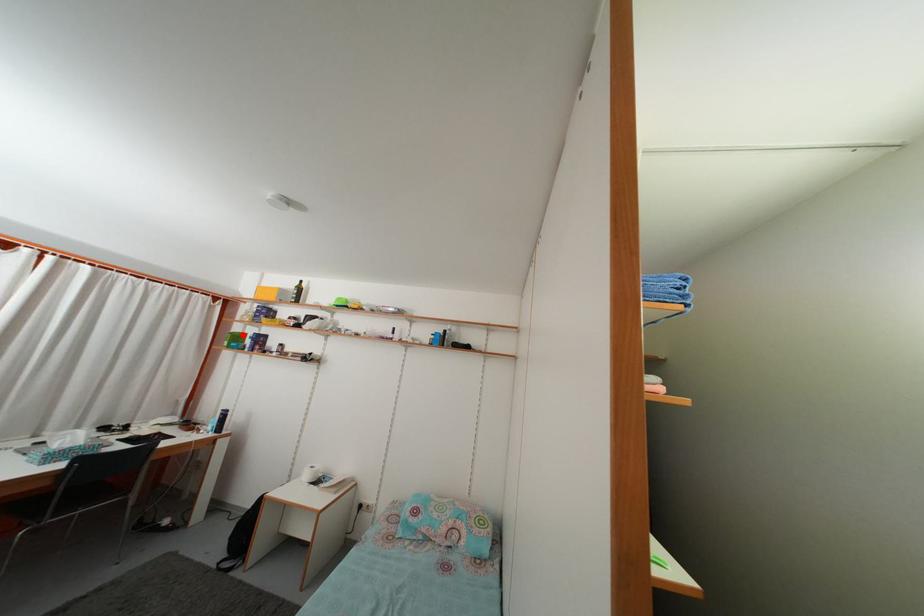
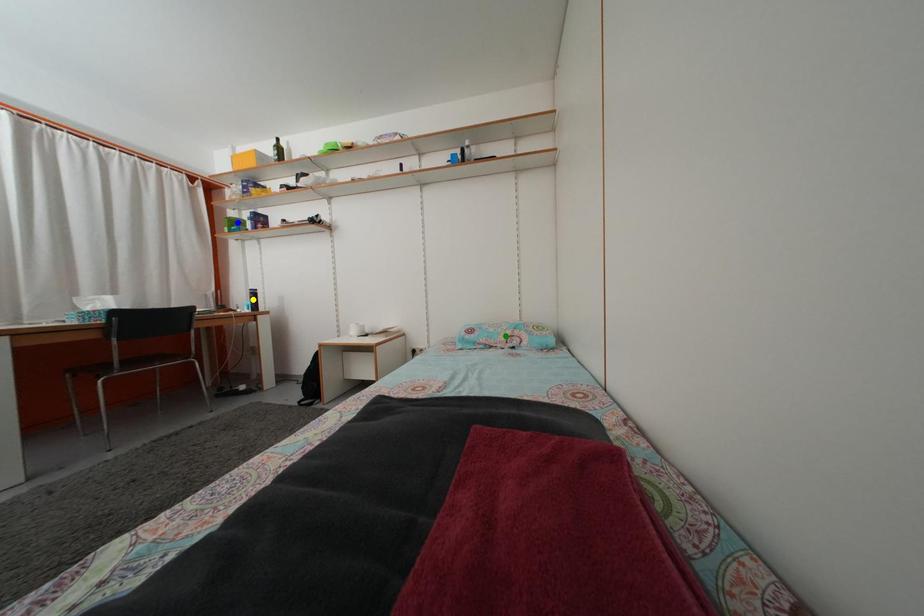
Question: I am providing you with two images of the same scene from different viewpoints. A red point is marked on the first image. You are given multiple points on the second image. In image 2, which mark is for the same physical point as the one in image 1?

Choices:
 (A) yellow point
 (B) blue point
 (C) green point

Answer: (B)